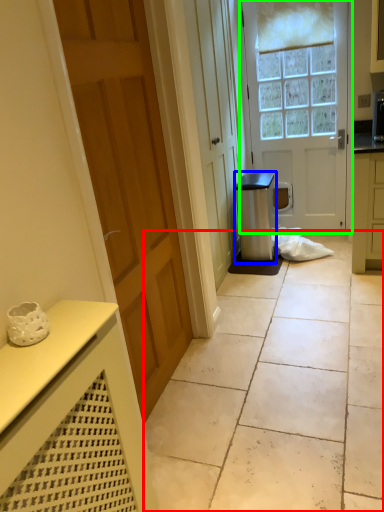
Question: Estimate the real-world distances between objects in this image. Which object is farther from concrete (highlighted by a red box), appliance (highlighted by a blue box) or door (highlighted by a green box)?

Choices:
 (A) appliance
 (B) door

Answer: (B)